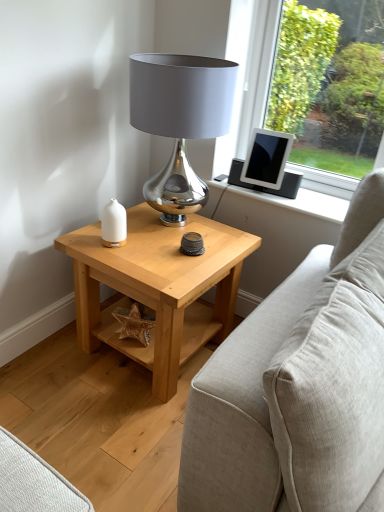
The width and height of the screenshot is (384, 512). What are the coordinates of `unoccupied space behind white matte candle holder at left` in the screenshot? It's located at (133, 227).